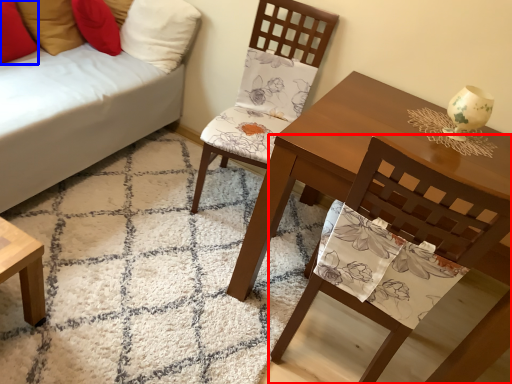
Question: Which object appears closest to the camera in this image, chair (highlighted by a red box) or pillow (highlighted by a blue box)?

Choices:
 (A) chair
 (B) pillow

Answer: (A)